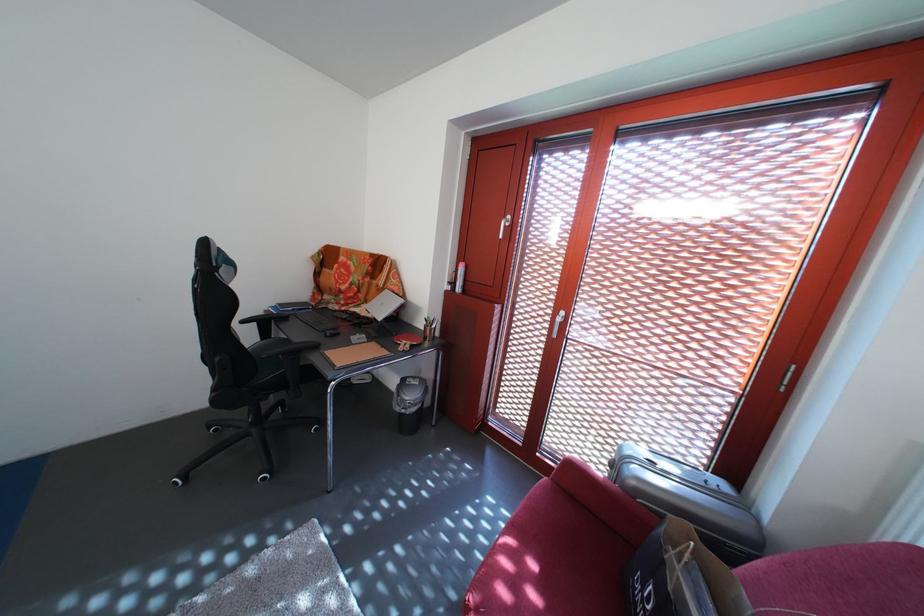
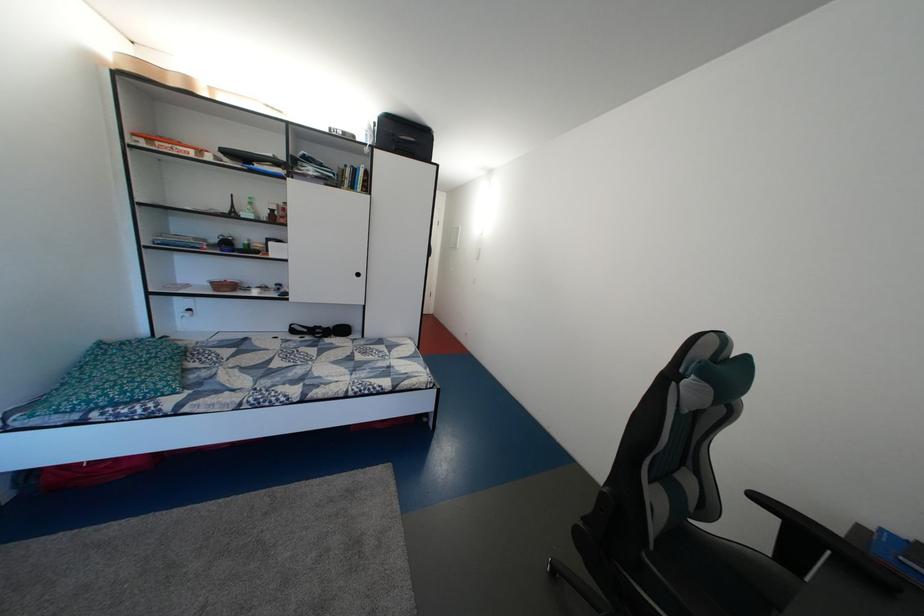
Where in the second image is the point corresponding to pixel 254 329 from the first image?

(768, 504)